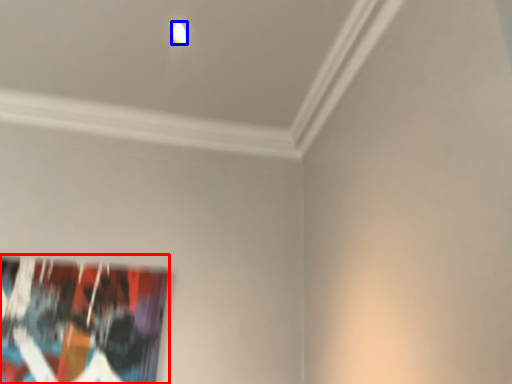
Question: Which of the following is the farthest to the observer, picture frame (highlighted by a red box) or light (highlighted by a blue box)?

Choices:
 (A) picture frame
 (B) light

Answer: (A)